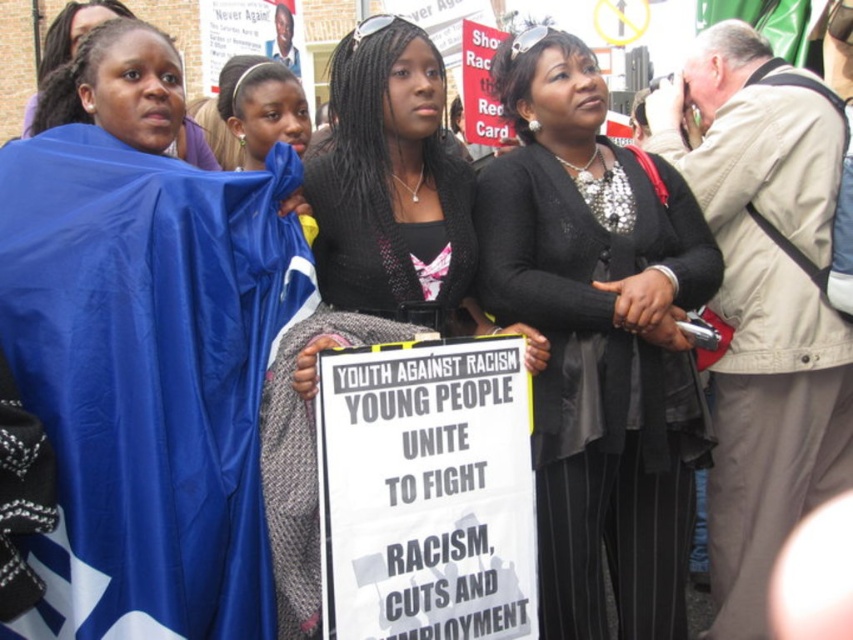
How far apart are the blue fabric at left and the sign?

The blue fabric at left and the sign are 60.60 feet apart.

You are a photographer trying to capture a closeup of the protest sign. You notice two points marked in the image at coordinates point (136,124) and point (386,124). Which point should you focus on to ensure the sign is in sharp focus?

You should focus on point (136,124) because it is closer to the camera than point (386,124), ensuring the sign is in sharp focus.

Looking at the protest scene, where is the blue fabric at left in relation to the black satin dress at center?

The blue fabric at left is to the left of the black satin dress at center.